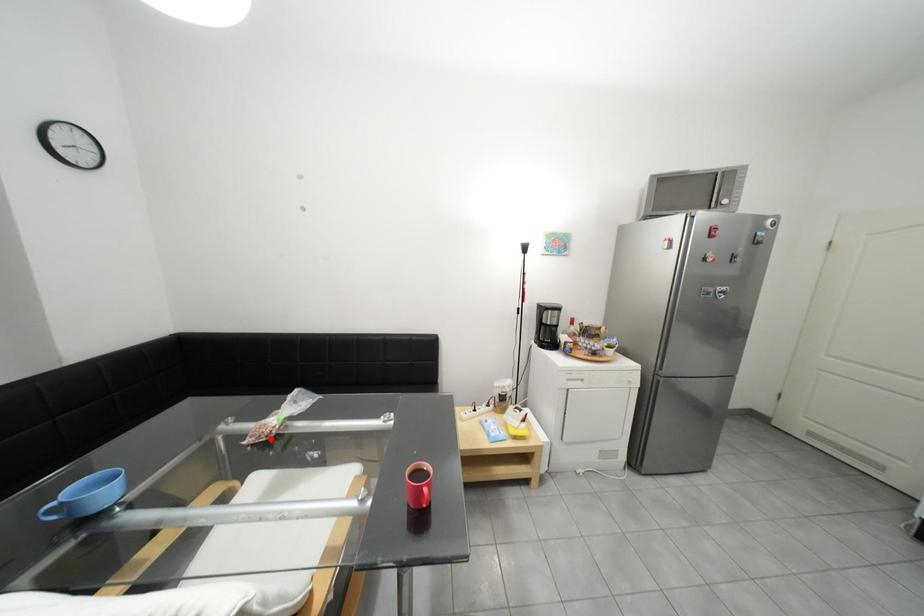
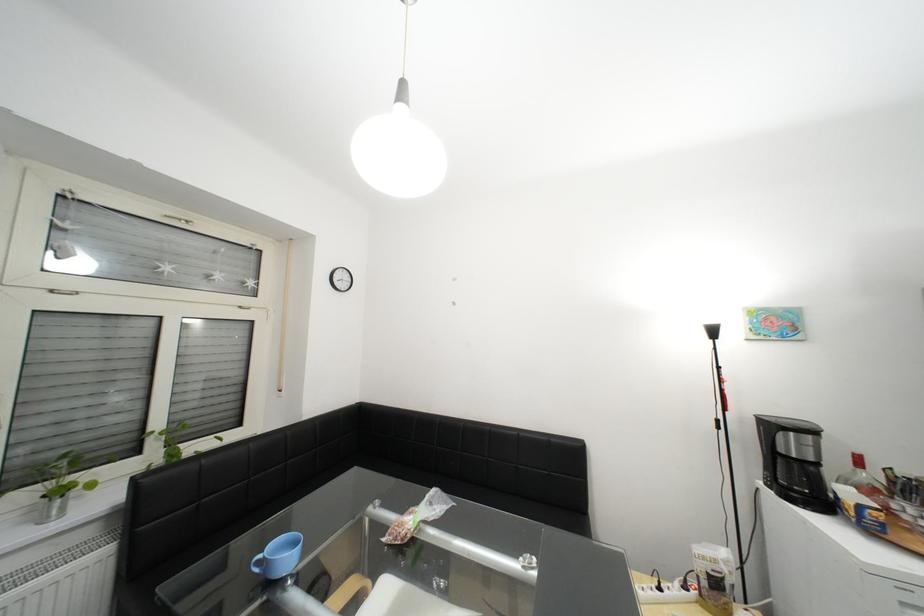
Where in the second image is the point corresponding to the highlighted location from the first image?

(407, 540)